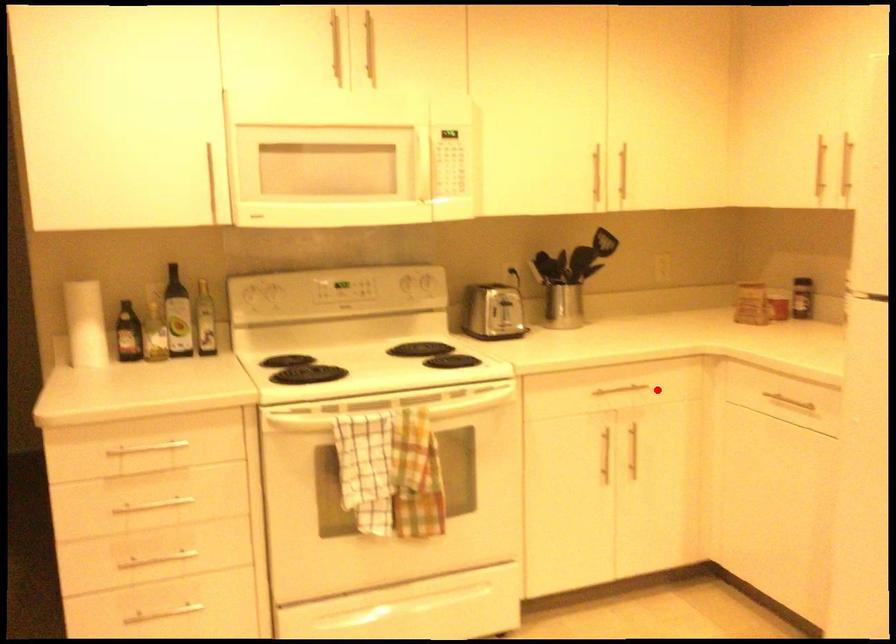
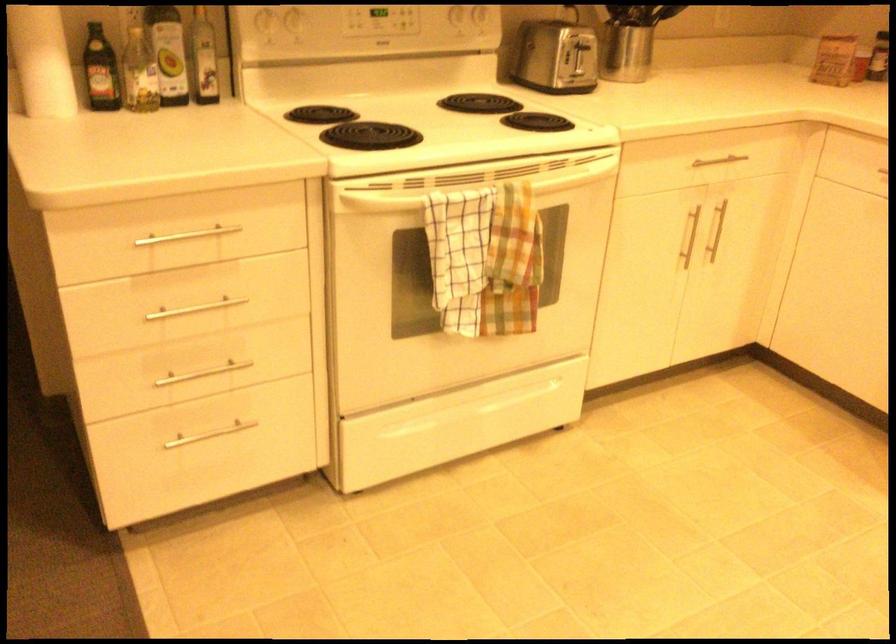
Question: I am providing you with two images of the same scene from different viewpoints. Given a red point in image1, look at the same physical point in image2. Is it:

Choices:
 (A) Closer to the viewpoint
 (B) Farther from the viewpoint

Answer: (A)